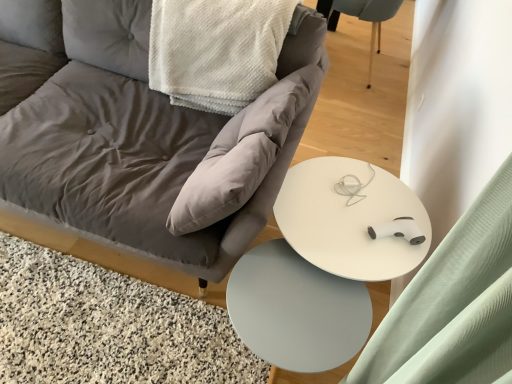
Question: Does white textured blanket at upper center have a smaller size compared to light blue fabric swivel chair at upper right?

Choices:
 (A) yes
 (B) no

Answer: (B)

Question: Is white textured blanket at upper center not inside light blue fabric swivel chair at upper right?

Choices:
 (A) no
 (B) yes

Answer: (B)

Question: Can you confirm if white textured blanket at upper center is positioned to the right of light blue fabric swivel chair at upper right?

Choices:
 (A) no
 (B) yes

Answer: (A)

Question: Is white textured blanket at upper center taller than light blue fabric swivel chair at upper right?

Choices:
 (A) no
 (B) yes

Answer: (A)

Question: Considering the relative sizes of white textured blanket at upper center and light blue fabric swivel chair at upper right in the image provided, is white textured blanket at upper center bigger than light blue fabric swivel chair at upper right?

Choices:
 (A) yes
 (B) no

Answer: (A)

Question: Are white textured blanket at upper center and light blue fabric swivel chair at upper right far apart?

Choices:
 (A) no
 (B) yes

Answer: (B)

Question: Is light blue fabric swivel chair at upper right not inside matte gray fabric chair at center?

Choices:
 (A) no
 (B) yes

Answer: (B)

Question: Can you confirm if light blue fabric swivel chair at upper right is shorter than matte gray fabric chair at center?

Choices:
 (A) yes
 (B) no

Answer: (A)

Question: Considering the relative positions of light blue fabric swivel chair at upper right and matte gray fabric chair at center in the image provided, is light blue fabric swivel chair at upper right to the right of matte gray fabric chair at center from the viewer's perspective?

Choices:
 (A) yes
 (B) no

Answer: (A)

Question: Does light blue fabric swivel chair at upper right appear on the left side of matte gray fabric chair at center?

Choices:
 (A) no
 (B) yes

Answer: (A)

Question: From a real-world perspective, is light blue fabric swivel chair at upper right positioned over matte gray fabric chair at center based on gravity?

Choices:
 (A) no
 (B) yes

Answer: (A)

Question: From a real-world perspective, is light blue fabric swivel chair at upper right physically below matte gray fabric chair at center?

Choices:
 (A) no
 (B) yes

Answer: (B)

Question: Does white glossy round table at center lie in front of matte gray fabric chair at center?

Choices:
 (A) no
 (B) yes

Answer: (A)